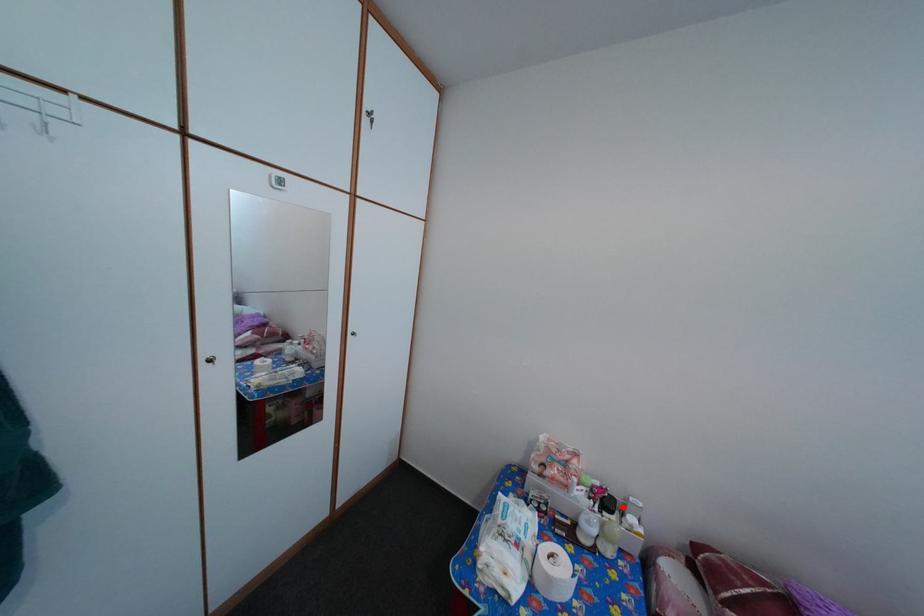
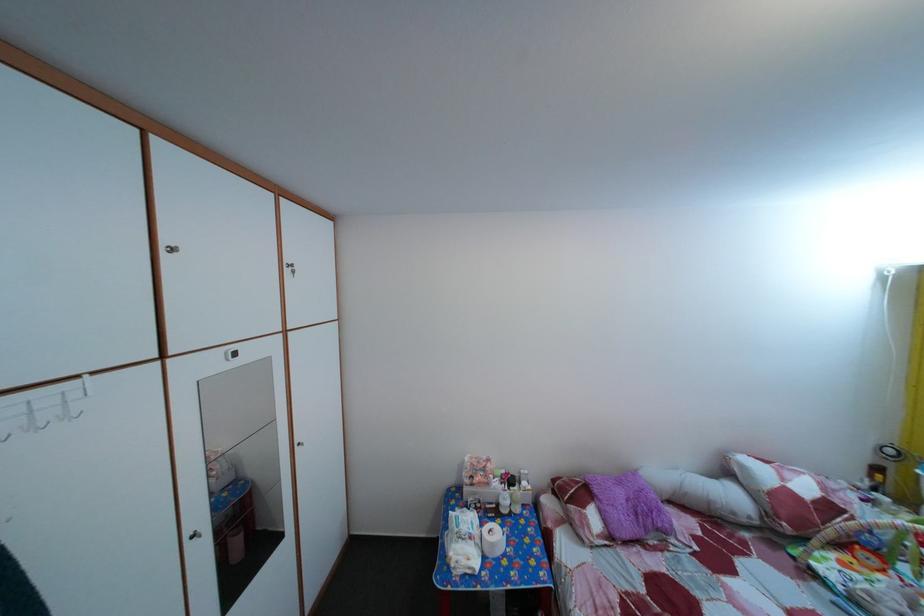
Locate, in the second image, the point that corresponds to the highlighted location in the first image.

(524, 485)